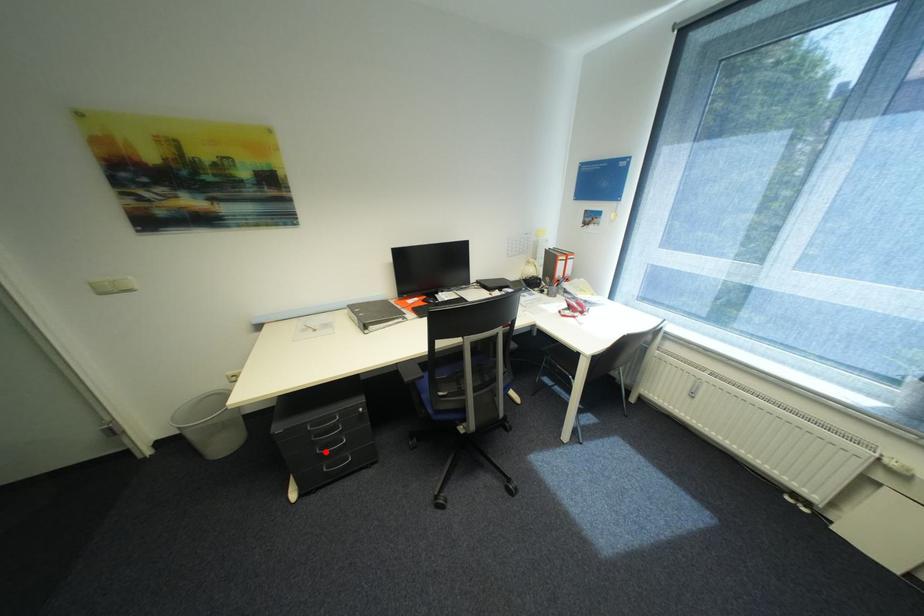
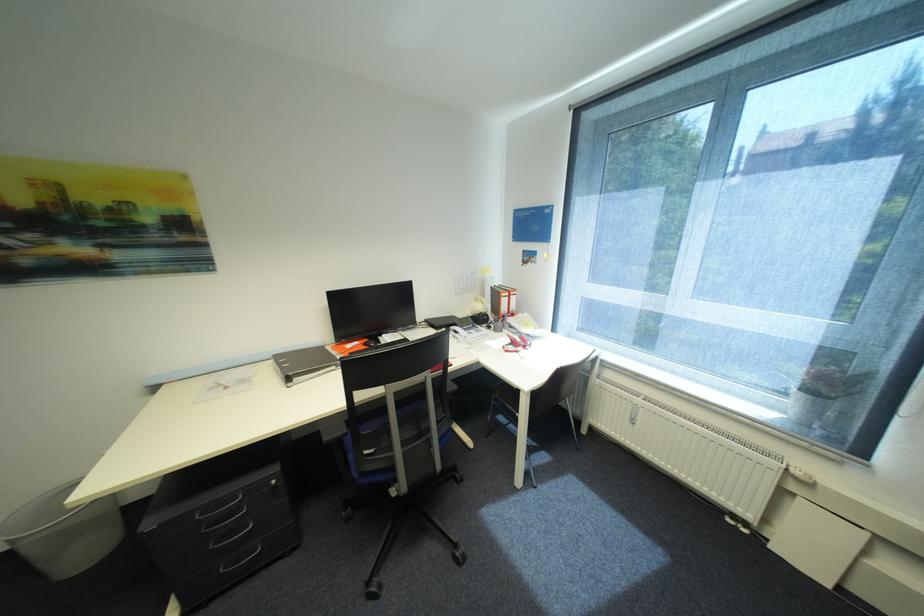
The point at the highlighted location is marked in the first image. Where is the corresponding point in the second image?

(219, 546)